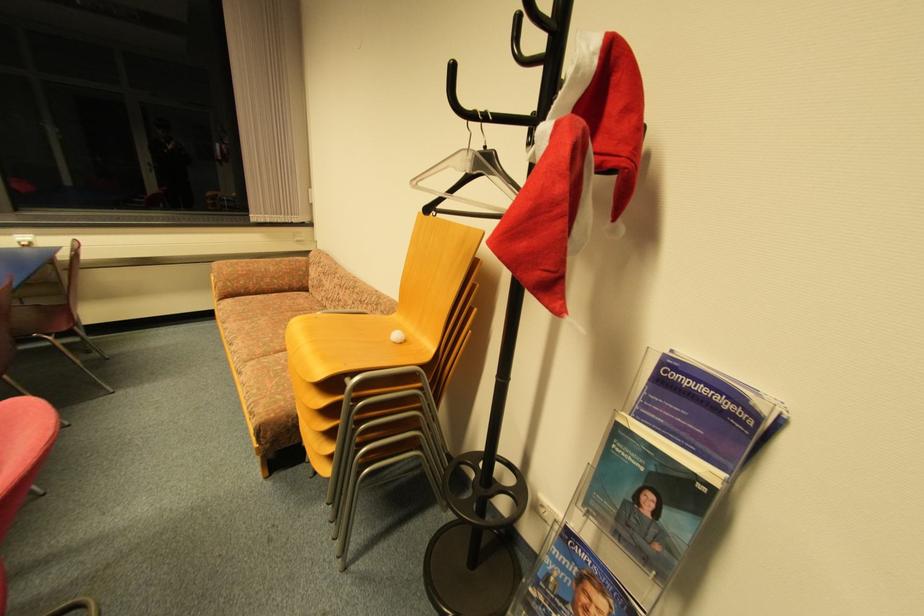
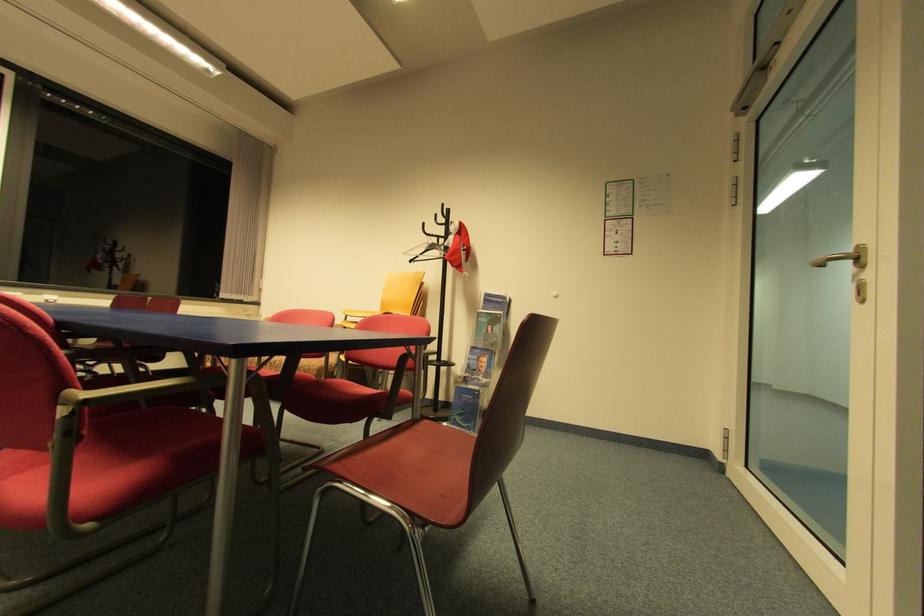
In the second image, find the point that corresponds to point (419, 184) in the first image.

(408, 254)